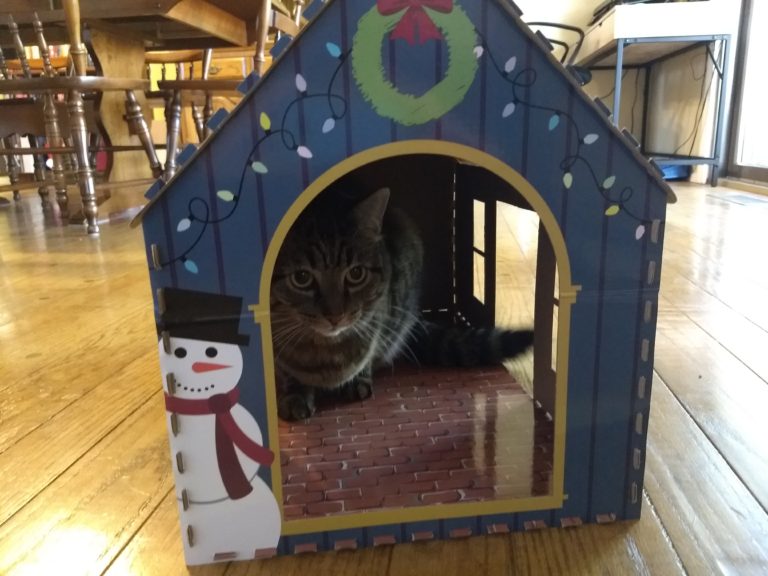
At what (x,y) coordinates should I click in order to perform the action: click on wood chair. Please return your answer as a coordinate pair (x, y). This screenshot has width=768, height=576. Looking at the image, I should click on (74, 78).